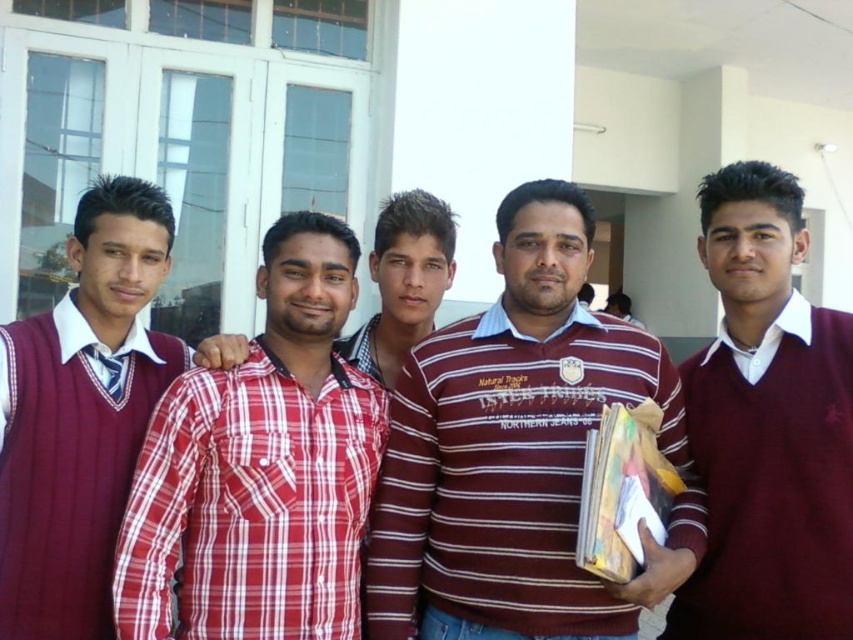
Question: Which of these objects is positioned closest to the maroon striped shirt at center?

Choices:
 (A) plaid cotton shirt at center
 (B) maroon sweater at right
 (C) maroon ribbed sweater at left
 (D) red plaid shirt at center

Answer: (D)

Question: Which object is closer to the camera taking this photo?

Choices:
 (A) maroon ribbed sweater at left
 (B) plaid cotton shirt at center

Answer: (A)

Question: From the image, what is the correct spatial relationship of maroon striped shirt at center in relation to red plaid shirt at center?

Choices:
 (A) left
 (B) right

Answer: (B)

Question: Which object is the closest to the maroon striped shirt at center?

Choices:
 (A) maroon ribbed sweater at left
 (B) maroon sweater at right
 (C) red plaid shirt at center

Answer: (C)

Question: From the image, what is the correct spatial relationship of red plaid shirt at center in relation to maroon ribbed sweater at left?

Choices:
 (A) right
 (B) left

Answer: (A)

Question: Observing the image, what is the correct spatial positioning of red plaid shirt at center in reference to plaid cotton shirt at center?

Choices:
 (A) right
 (B) left

Answer: (B)